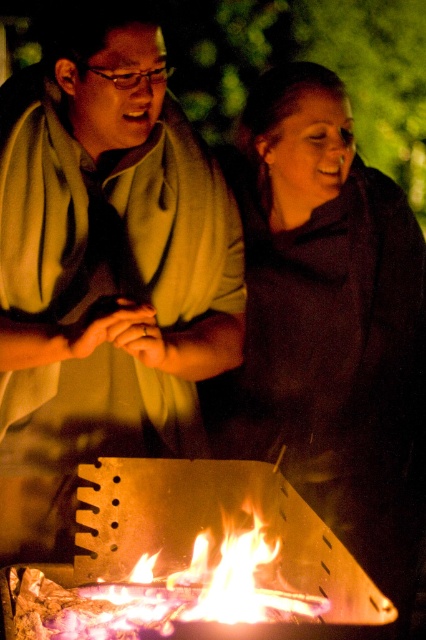
Question: In this image, where is black matte apron at center located relative to flaming wood at center?

Choices:
 (A) below
 (B) above

Answer: (B)

Question: Among these points, which one is farthest from the camera?

Choices:
 (A) (118, 276)
 (B) (233, 577)

Answer: (A)

Question: Which object is closer to the camera taking this photo?

Choices:
 (A) flaming wood at center
 (B) black matte apron at center

Answer: (A)

Question: Is matte green scarf at center below black matte apron at center?

Choices:
 (A) no
 (B) yes

Answer: (A)

Question: Is black matte apron at center bigger than flaming wood at center?

Choices:
 (A) yes
 (B) no

Answer: (A)

Question: Considering the real-world distances, which object is closest to the black matte apron at center?

Choices:
 (A) matte green scarf at center
 (B) flaming wood at center

Answer: (A)